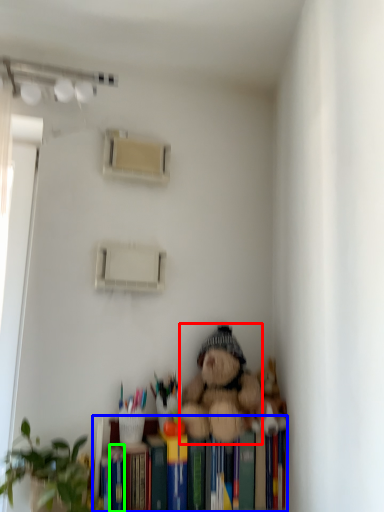
Question: Considering the real-world distances, which object is farthest from teddy bear (highlighted by a red box)? bookshelf (highlighted by a blue box) or paperback book (highlighted by a green box)?

Choices:
 (A) bookshelf
 (B) paperback book

Answer: (B)